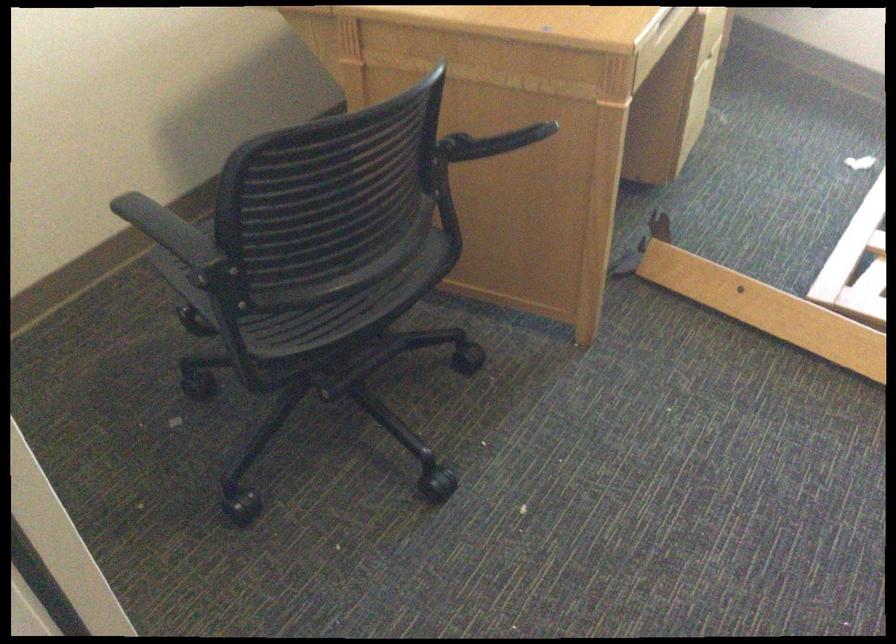
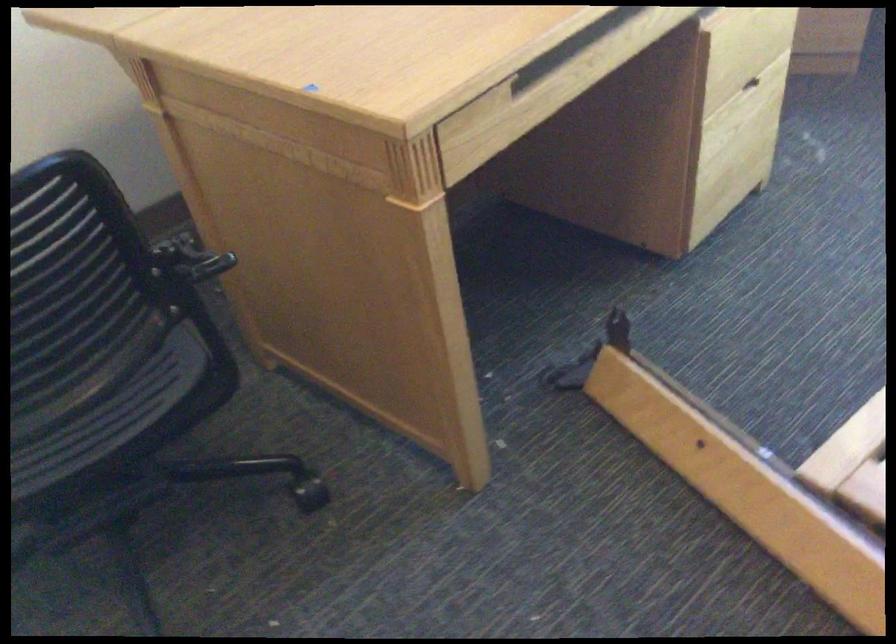
Question: The first image is from the beginning of the video and the second image is from the end. How did the camera likely rotate when shooting the video?

Choices:
 (A) Left
 (B) Right
 (C) Up
 (D) Down

Answer: (A)